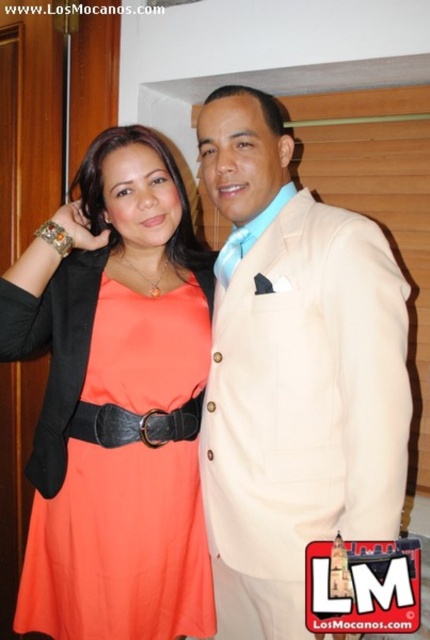
Question: Which point is closer to the camera?

Choices:
 (A) coral fabric dress at center
 (B) beige fabric suit at center
 (C) black leather belt at center

Answer: (B)

Question: Can you confirm if beige fabric suit at center is positioned above coral fabric dress at center?

Choices:
 (A) no
 (B) yes

Answer: (B)

Question: Does coral fabric dress at center appear on the left side of black leather belt at center?

Choices:
 (A) no
 (B) yes

Answer: (B)

Question: Which point is closer to the camera?

Choices:
 (A) beige fabric suit at center
 (B) coral fabric dress at center

Answer: (A)

Question: Considering the real-world distances, which object is closest to the coral fabric dress at center?

Choices:
 (A) black leather belt at center
 (B) beige fabric suit at center

Answer: (A)

Question: Does beige fabric suit at center have a smaller size compared to black leather belt at center?

Choices:
 (A) yes
 (B) no

Answer: (B)